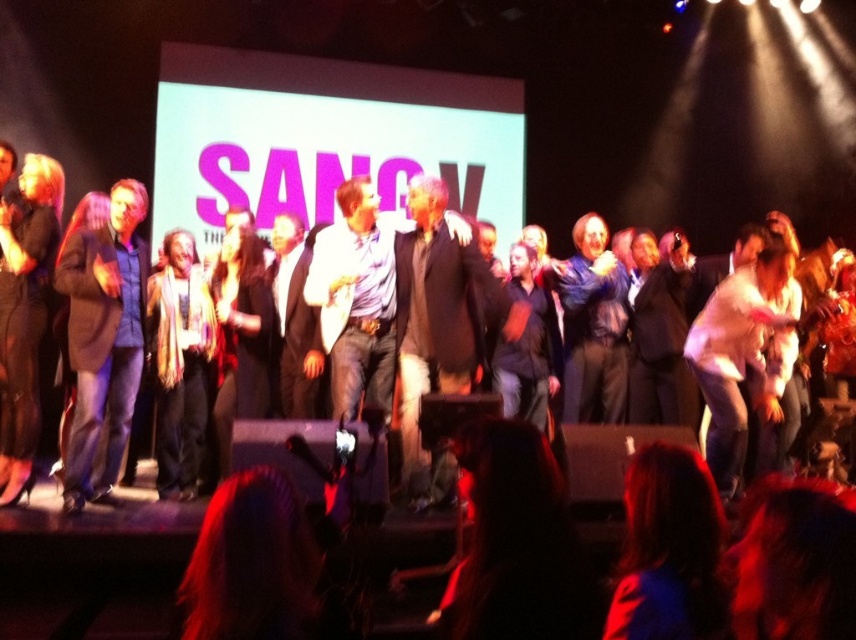
You are a stagehand who needs to place a 1.5 meter long banner between the dark hair at lower center and the fuzzy scarf at center. Is there enough space to fit the banner without overlapping either object?

The dark hair at lower center is 3.26 meters from the fuzzy scarf at center. Since the banner is only 1.5 meters long, there is sufficient space to place it between them without overlapping either object.

You are a photographer on the stage and want to take a photo of the dark blue jeans at center without the black suit at center blocking it. What should you do?

The black suit at center is in front of dark blue jeans at center, so to avoid blocking, move to a position where the dark blue jeans at center is visible behind the black suit at center or adjust the angle to frame around them.